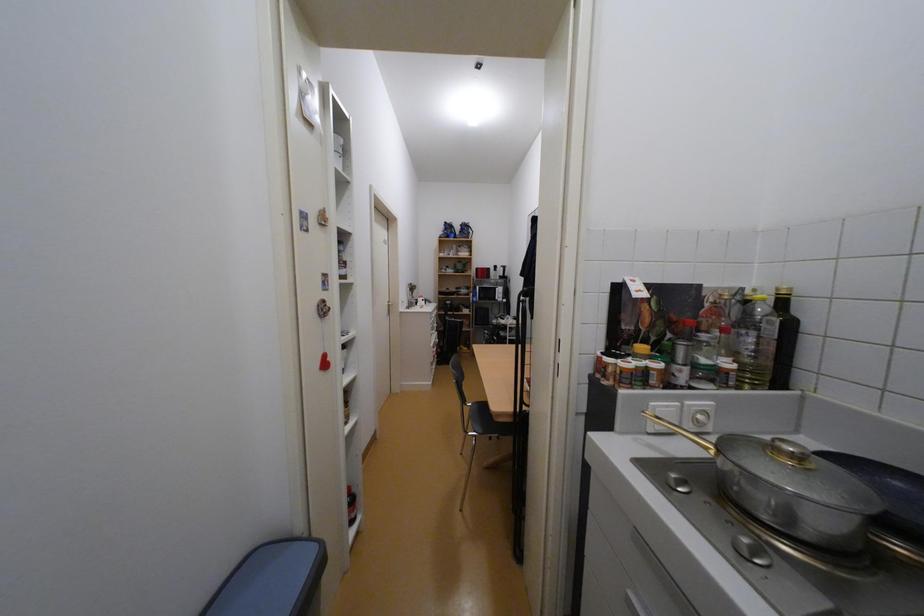
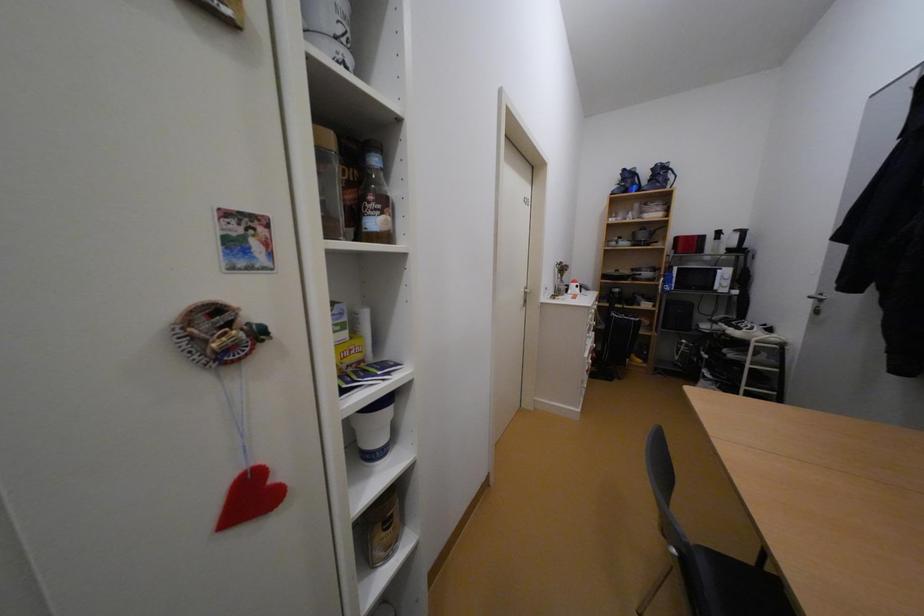
Question: The first image is from the beginning of the video and the second image is from the end. How did the camera likely rotate when shooting the video?

Choices:
 (A) Left
 (B) Right
 (C) Up
 (D) Down

Answer: (A)